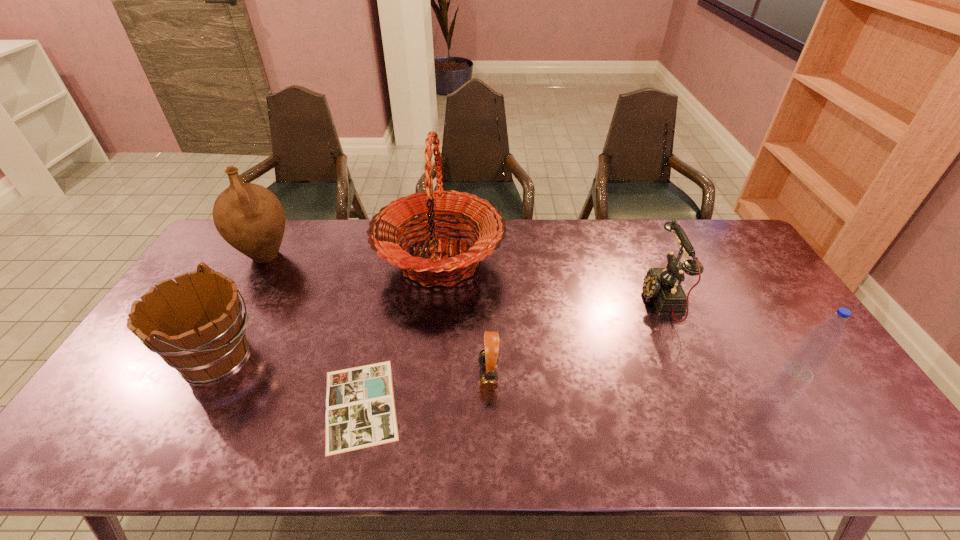
Identify the location of vacant space that's between the tallest object and the second shortest object. The image size is (960, 540). (464, 318).

You are a GUI agent. You are given a task and a screenshot of the screen. Output one action in this format:
    pyautogui.click(x=<x>, y=<y>)
    Task: Click on the free point between the basket and the telephone
    The width and height of the screenshot is (960, 540).
    Given the screenshot: What is the action you would take?
    tap(551, 280)

Find the location of a particular element. The width and height of the screenshot is (960, 540). free space between the second object from right to left and the basket is located at coordinates (551, 280).

You are a GUI agent. You are given a task and a screenshot of the screen. Output one action in this format:
    pyautogui.click(x=<x>, y=<y>)
    Task: Click on the empty location between the telephone and the tallest object
    The image size is (960, 540).
    Given the screenshot: What is the action you would take?
    coord(551,280)

At what (x,y) coordinates should I click in order to perform the action: click on free space between the rightmost object and the headset. Please return your answer as a coordinate pair (x, y). Image resolution: width=960 pixels, height=540 pixels. Looking at the image, I should click on (643, 374).

In order to click on free spot between the tallest object and the rightmost object in this screenshot , I will do `click(619, 316)`.

Where is `unoccupied position between the second object from right to left and the second shortest object`? Image resolution: width=960 pixels, height=540 pixels. unoccupied position between the second object from right to left and the second shortest object is located at coordinates (575, 338).

Locate an element on the screen. The width and height of the screenshot is (960, 540). free spot between the shortest object and the telephone is located at coordinates (512, 352).

Where is `free space between the book and the second object from right to left`? This screenshot has width=960, height=540. free space between the book and the second object from right to left is located at coordinates (512, 352).

The image size is (960, 540). What are the coordinates of `object that is the fifth nearest to the basket` in the screenshot? It's located at (663, 285).